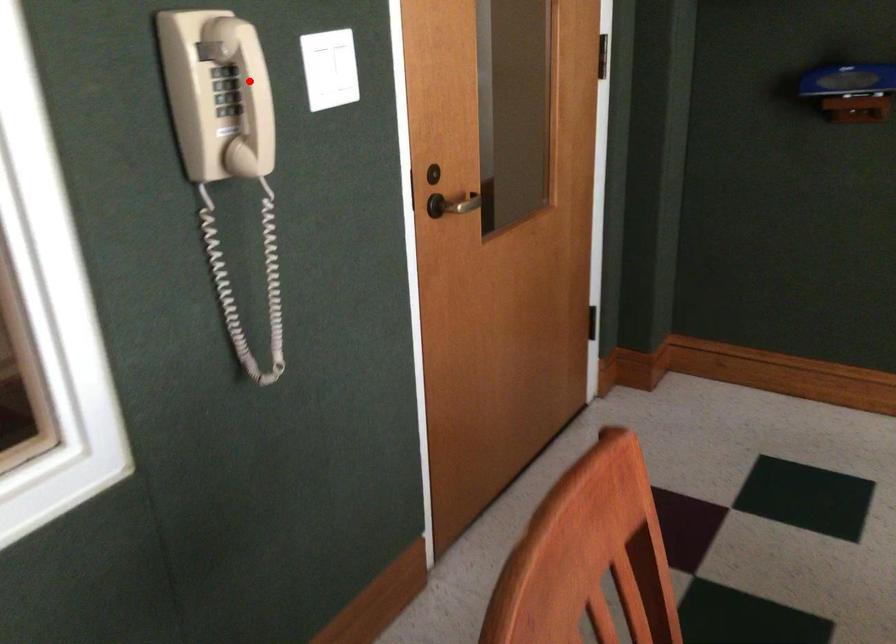
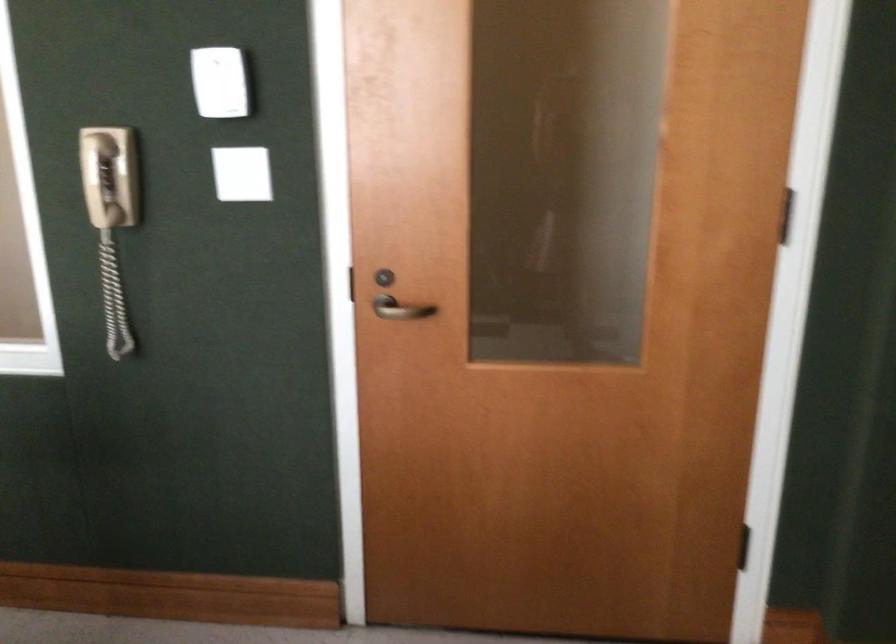
Question: I am providing you with two images of the same scene from different viewpoints. Given a red point in image1, look at the same physical point in image2. Is it:

Choices:
 (A) Closer to the viewpoint
 (B) Farther from the viewpoint

Answer: (B)